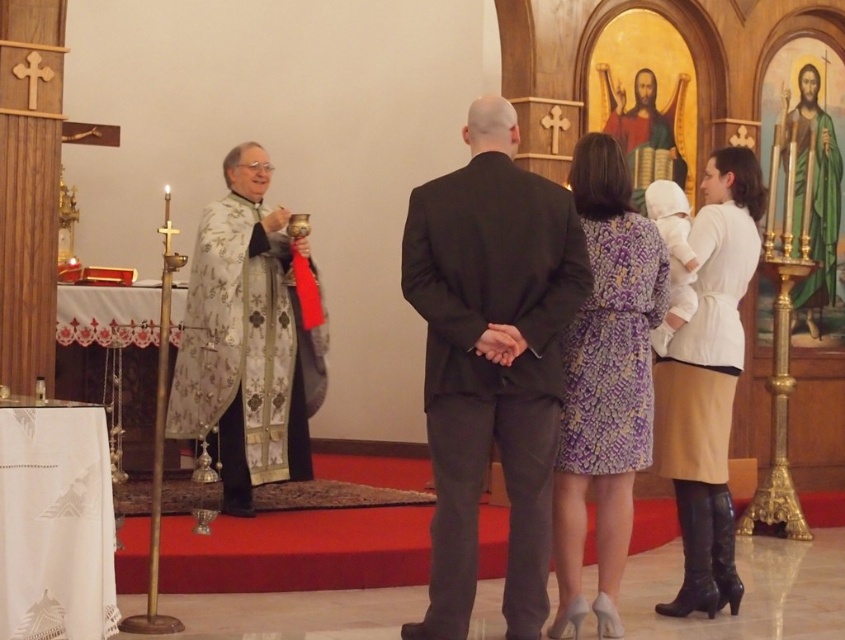
From the picture: You are a photographer at the ceremony. You need to capture a photo of both the silver embroidered robe at left and the purple printed dress at center. Which one should you zoom in on to ensure it appears larger in the photo?

The silver embroidered robe at left is larger in size than the purple printed dress at center, so you should zoom in on the silver embroidered robe at left to ensure it appears larger in the photo.

In the scene shown: What is located at the point marked as coordinates (246, 340) in the image?

The point marked at coordinates (246, 340) is located at the silver embroidered robe at left.